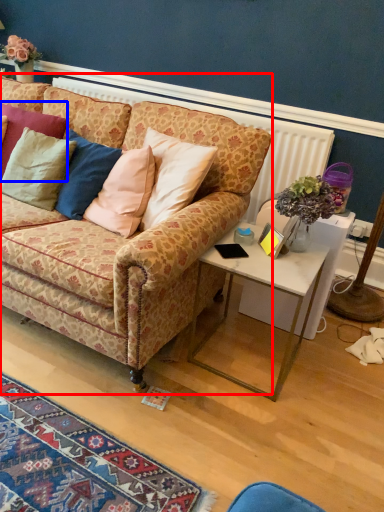
Question: Which point is closer to the camera, studio couch (highlighted by a red box) or pillow (highlighted by a blue box)?

Choices:
 (A) studio couch
 (B) pillow

Answer: (A)